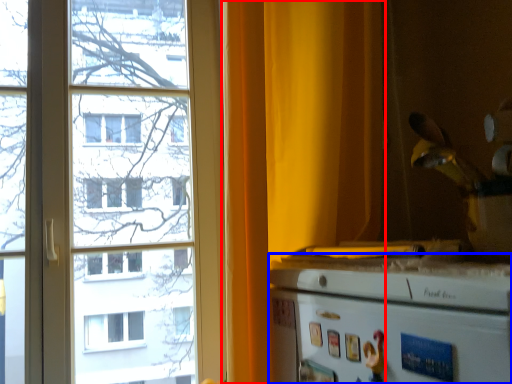
Question: Among these objects, which one is farthest to the camera, curtain (highlighted by a red box) or appliance (highlighted by a blue box)?

Choices:
 (A) curtain
 (B) appliance

Answer: (A)